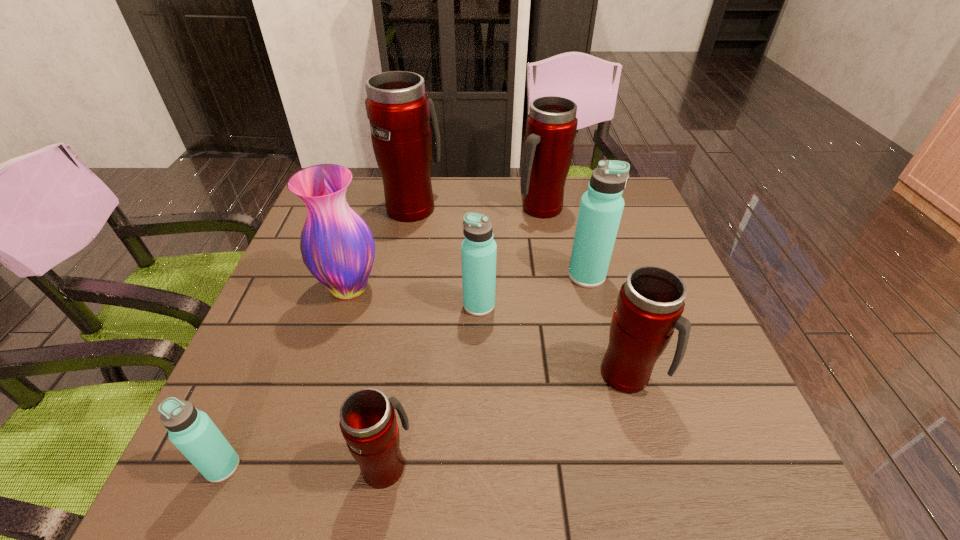
This screenshot has width=960, height=540. In order to click on free spot between the fifth farthest thermos bottle and the purple vase in this screenshot , I will do `click(489, 332)`.

The width and height of the screenshot is (960, 540). I want to click on vacant space in between the fourth object from right to left and the leftmost thermos bottle, so click(x=350, y=386).

Identify which object is the seventh closest to the smallest red thermos bottle. Please provide its 2D coordinates. Your answer should be formatted as a tuple, i.e. [(x, y)], where the tuple contains the x and y coordinates of a point satisfying the conditions above.

[(551, 125)]

What are the coordinates of `object identified as the sixth closest to the tallest thermos bottle` in the screenshot? It's located at (368, 423).

The image size is (960, 540). Find the location of `thermos bottle identified as the sixth closest to the tallest object`. thermos bottle identified as the sixth closest to the tallest object is located at coordinates (192, 431).

Select which thermos bottle appears as the fourth closest to the biggest red thermos bottle. Please provide its 2D coordinates. Your answer should be formatted as a tuple, i.e. [(x, y)], where the tuple contains the x and y coordinates of a point satisfying the conditions above.

[(650, 303)]

I want to click on red thermos bottle that is the third closest to the second aqua thermos bottle from right to left, so click(x=551, y=125).

Find the location of a particular element. This screenshot has height=540, width=960. red thermos bottle that is the closest to the vase is located at coordinates (405, 136).

Find the location of a particular element. This screenshot has height=540, width=960. aqua thermos bottle that stands as the second closest to the third smallest red thermos bottle is located at coordinates (478, 250).

Identify which aqua thermos bottle is the nearest to the leftmost object. Please provide its 2D coordinates. Your answer should be formatted as a tuple, i.e. [(x, y)], where the tuple contains the x and y coordinates of a point satisfying the conditions above.

[(478, 250)]